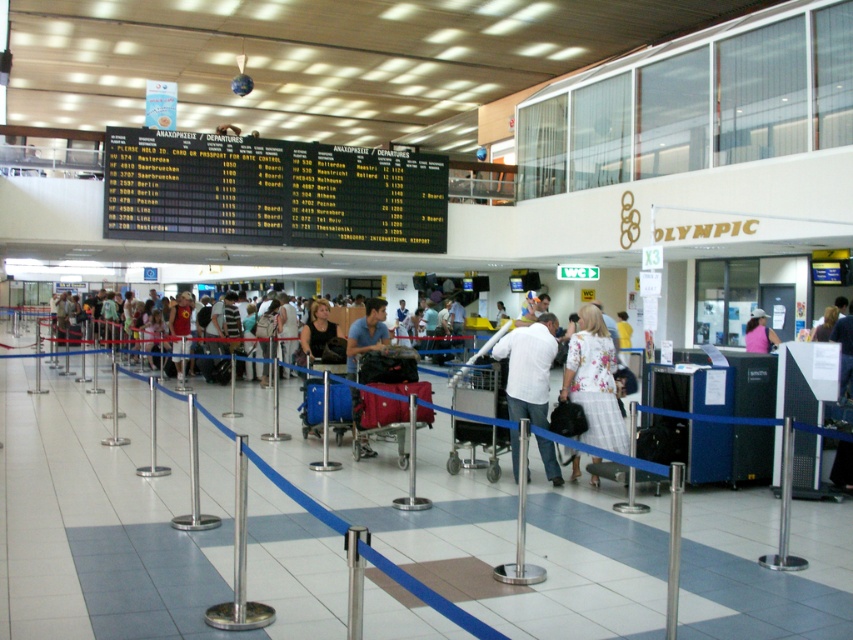
You are a traveler at the Olympic Airlines check in area. You see a blue fabric suitcase at center. Where is the blue fabric suitcase located in the check in area?

The blue fabric suitcase at center is located at point (312,401) in the check in area.

You are a traveler at the Olympic Airlines check in counter. You notice a blue fabric suitcase at center and a pink fabric shirt at center. Which item is closer to the floor?

The blue fabric suitcase at center is below pink fabric shirt at center, so it is closer to the floor.

You are at the Olympic Airlines check in area and see the maroon fabric suitcase at center. Where exactly is it located in terms of coordinates?

The maroon fabric suitcase at center is located at point (378, 410).